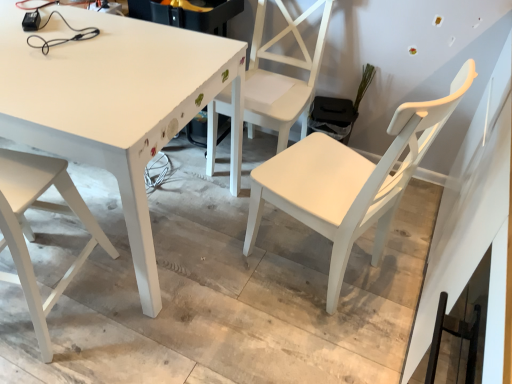
Question: From a real-world perspective, is white matte chair at lower left, marked as the first chair in a left-to-right arrangement, positioned above or below white painted wood table at center?

Choices:
 (A) above
 (B) below

Answer: (A)

Question: Does point (95, 221) appear closer or farther from the camera than point (137, 34)?

Choices:
 (A) closer
 (B) farther

Answer: (A)

Question: Which object is positioned closest to the white matte chair at center, arranged as the second chair when viewed from the right?

Choices:
 (A) white matte chair at lower left, marked as the first chair in a left-to-right arrangement
 (B) white matte chair at center, which is the 3th chair from left to right
 (C) white painted wood table at center

Answer: (C)

Question: Which object is positioned closest to the white matte chair at center, the second chair viewed from the left?

Choices:
 (A) white matte chair at center, which appears as the 1th chair when viewed from the right
 (B) white painted wood table at center
 (C) white matte chair at lower left, placed as the third chair when sorted from right to left

Answer: (B)